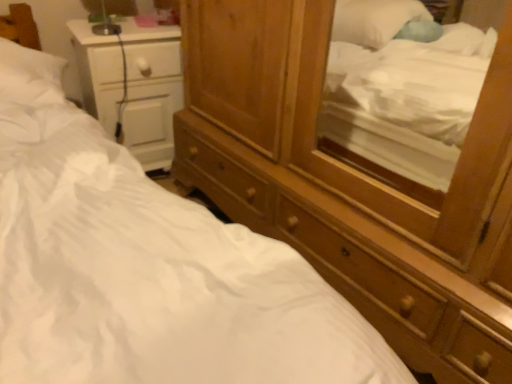
Locate an element on the screen. white glossy nightstand at left is located at coordinates (151, 92).

Measure the distance between point (165, 117) and camera.

A distance of 6.34 feet exists between point (165, 117) and camera.

Describe the element at coordinates (151, 92) in the screenshot. I see `white glossy nightstand at left` at that location.

What is the approximate width of white glossy nightstand at left?

14.72 inches.

The height and width of the screenshot is (384, 512). I want to click on wooden dresser at center, so click(x=368, y=255).

Describe the element at coordinates (368, 255) in the screenshot. The width and height of the screenshot is (512, 384). I see `wooden dresser at center` at that location.

Where is `white glossy nightstand at left`? This screenshot has height=384, width=512. white glossy nightstand at left is located at coordinates (151, 92).

Which is more to the left, wooden dresser at center or white glossy nightstand at left?

white glossy nightstand at left.

Is the depth of wooden dresser at center greater than that of white glossy nightstand at left?

No, it is not.

Which is closer, (229, 172) or (126, 48)?

The point (229, 172) is closer.

From the image's perspective, between wooden dresser at center and white glossy nightstand at left, who is located below?

wooden dresser at center is shown below in the image.

From a real-world perspective, is wooden dresser at center beneath white glossy nightstand at left?

Incorrect, from a real-world perspective, wooden dresser at center is higher than white glossy nightstand at left.

Considering the sizes of objects wooden dresser at center and white glossy nightstand at left in the image provided, who is wider, wooden dresser at center or white glossy nightstand at left?

wooden dresser at center is wider.

Between wooden dresser at center and white glossy nightstand at left, which one has more height?

wooden dresser at center.

Between wooden dresser at center and white glossy nightstand at left, which one has larger size?

wooden dresser at center is bigger.

Would you say white glossy nightstand at left is part of wooden dresser at center's contents?

Actually, white glossy nightstand at left is outside wooden dresser at center.

Would you say wooden dresser at center is a long distance from white glossy nightstand at left?

No, there isn't a large distance between wooden dresser at center and white glossy nightstand at left.

Is wooden dresser at center oriented towards white glossy nightstand at left?

No, wooden dresser at center is not turned towards white glossy nightstand at left.

Where is `nightstand above the wooden dresser at center (from the image's perspective)`? This screenshot has width=512, height=384. nightstand above the wooden dresser at center (from the image's perspective) is located at coordinates (151, 92).

Between white glossy nightstand at left and wooden dresser at center, which one appears on the left side from the viewer's perspective?

white glossy nightstand at left.

Which is behind, white glossy nightstand at left or wooden dresser at center?

white glossy nightstand at left is behind.

Is point (84, 71) more distant than point (260, 207)?

Yes, it is behind point (260, 207).

From the image's perspective, is white glossy nightstand at left above wooden dresser at center?

Yes, from the image's perspective, white glossy nightstand at left is above wooden dresser at center.

From a real-world perspective, which object stands above the other?

In real-world perspective, wooden dresser at center is above.

Can you confirm if white glossy nightstand at left is wider than wooden dresser at center?

In fact, white glossy nightstand at left might be narrower than wooden dresser at center.

Consider the image. In terms of height, does white glossy nightstand at left look taller or shorter compared to wooden dresser at center?

Considering their sizes, white glossy nightstand at left has less height than wooden dresser at center.

Who is bigger, white glossy nightstand at left or wooden dresser at center?

With larger size is wooden dresser at center.

Which is correct: white glossy nightstand at left is inside wooden dresser at center, or outside of it?

white glossy nightstand at left is outside wooden dresser at center.

Is there a large distance between white glossy nightstand at left and wooden dresser at center?

That's not correct — white glossy nightstand at left is a little close to wooden dresser at center.

Is wooden dresser at center at the back of white glossy nightstand at left?

No.

This screenshot has width=512, height=384. Identify the location of dresser positioned vertically above the white glossy nightstand at left (from a real-world perspective). click(x=368, y=255).

Where is `nightstand below the wooden dresser at center (from a real-world perspective)`? The width and height of the screenshot is (512, 384). nightstand below the wooden dresser at center (from a real-world perspective) is located at coordinates (151, 92).

Identify the location of nightstand located on the left of wooden dresser at center. Image resolution: width=512 pixels, height=384 pixels. (151, 92).